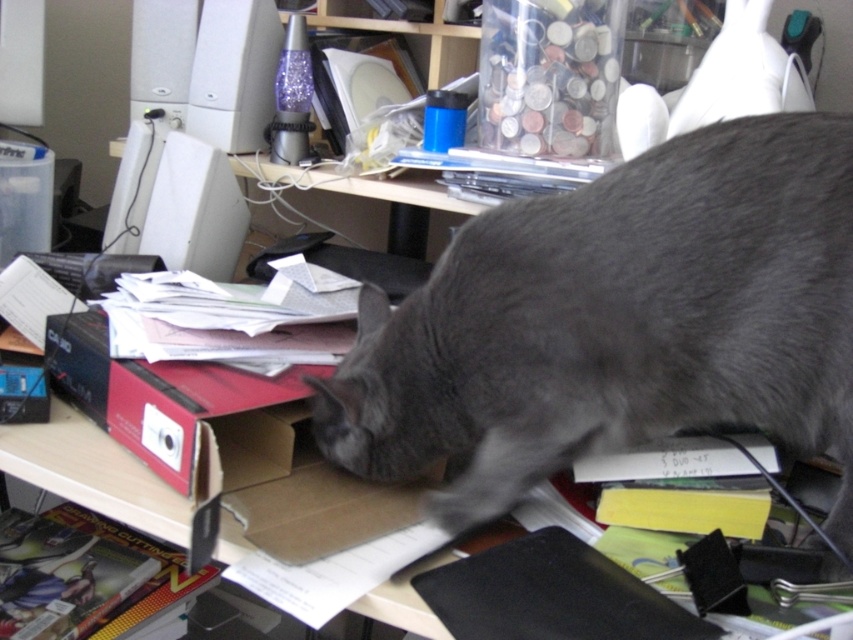
What do you see at coordinates (618, 321) in the screenshot? Image resolution: width=853 pixels, height=640 pixels. I see `gray fur cat at center` at bounding box center [618, 321].

Is gray fur cat at center above white plastic computer at upper left?

No.

The height and width of the screenshot is (640, 853). What are the coordinates of `gray fur cat at center` in the screenshot? It's located at (618, 321).